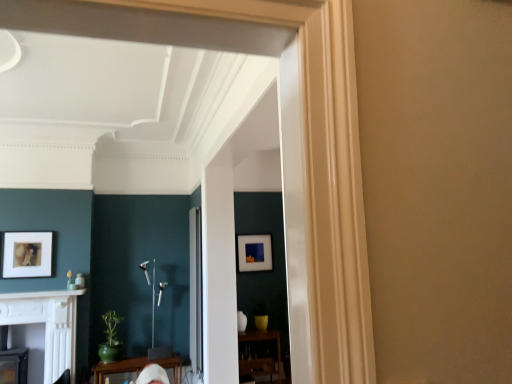
Question: Based on their positions, is clear glass door at center located to the left or right of white marble fireplace at lower left?

Choices:
 (A) left
 (B) right

Answer: (B)

Question: From a real-world perspective, is clear glass door at center physically located above or below white marble fireplace at lower left?

Choices:
 (A) above
 (B) below

Answer: (B)

Question: Based on their relative distances, which object is farther from the white marble fireplace at lower left?

Choices:
 (A) white glossy fireplace at lower left
 (B) matte black picture frame at center, the first picture frame from the back
 (C) clear glass door at center
 (D) green glossy table at lower center, the first table viewed from the left
 (E) wooden table at lower center, which is the 1th table from right to left

Answer: (E)

Question: Which is farther from the matte black picture frame at center, which ranks as the 1th picture frame in right-to-left order?

Choices:
 (A) clear glass door at center
 (B) matte white picture frame at left, arranged as the 1th picture frame when viewed from the front
 (C) white marble fireplace at lower left
 (D) wooden table at lower center, which is the 1th table from right to left
 (E) green glossy table at lower center, the first table viewed from the left

Answer: (B)